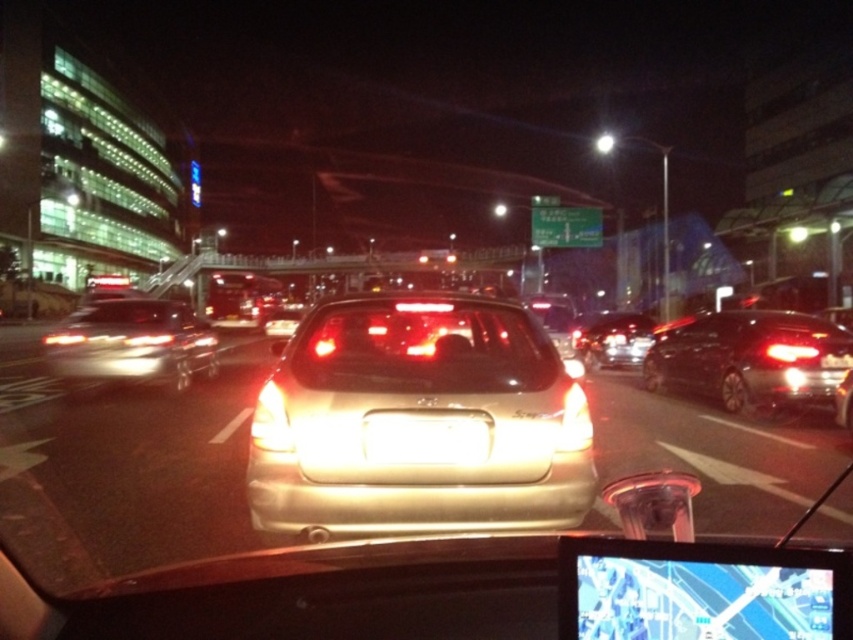
You are a driver in a vehicle and you see the glossy black sedan at right and the shiny silver sedan at center ahead of you. Which car is closer to you?

The glossy black sedan at right is smaller than the shiny silver sedan at center, so it is farther away from you.

You are a passenger in a car and looking out the window. You see a glossy black sedan at right and a shiny silver sedan at center. Which car is positioned more to the right?

The glossy black sedan at right is positioned more to the right than the shiny silver sedan at center.